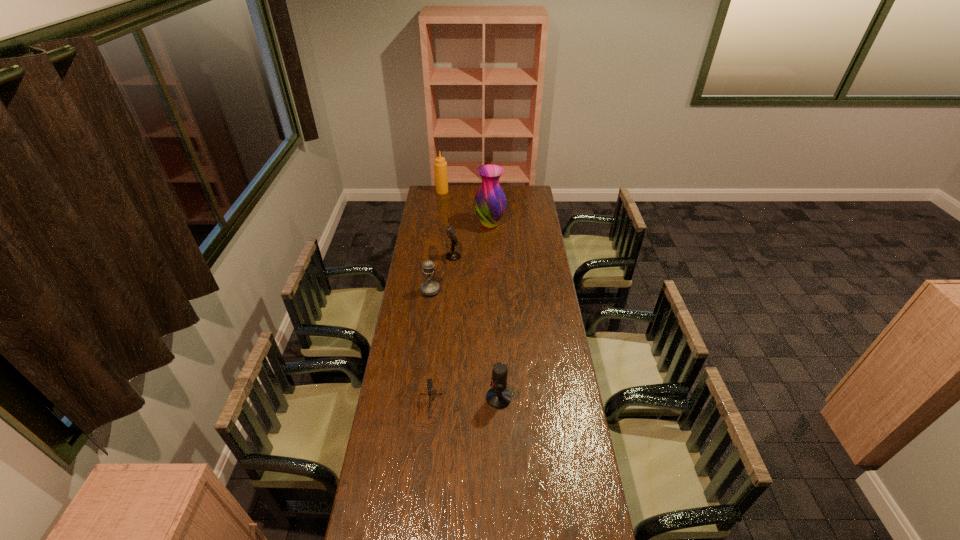
Identify which object is the second nearest to the second farthest object. Please provide its 2D coordinates. Your answer should be formatted as a tuple, i.e. [(x, y)], where the tuple contains the x and y coordinates of a point satisfying the conditions above.

[(440, 165)]

Identify which object is the nearest to the condiment. Please provide its 2D coordinates. Your answer should be formatted as a tuple, i.e. [(x, y)], where the tuple contains the x and y coordinates of a point satisfying the conditions above.

[(490, 201)]

The image size is (960, 540). What are the coordinates of `microphone that is the third closest to the third nearest object` in the screenshot? It's located at (498, 397).

Where is `microphone that is the third nearest to the fifth shortest object`? microphone that is the third nearest to the fifth shortest object is located at coordinates (498, 397).

The height and width of the screenshot is (540, 960). Find the location of `free space that satisfies the following two spatial constraints: 1. on the side of the rightmost microphone with the red ring; 2. on the stand of the shortest object`. free space that satisfies the following two spatial constraints: 1. on the side of the rightmost microphone with the red ring; 2. on the stand of the shortest object is located at coordinates (499, 409).

I want to click on free space that satisfies the following two spatial constraints: 1. on the front-facing side of the fourth nearest object; 2. on the front-facing side of the second farthest microphone, so click(x=448, y=291).

Locate an element on the screen. Image resolution: width=960 pixels, height=540 pixels. free spot that satisfies the following two spatial constraints: 1. on the side of the rightmost microphone with the red ring; 2. on the stand of the shortest object is located at coordinates (499, 409).